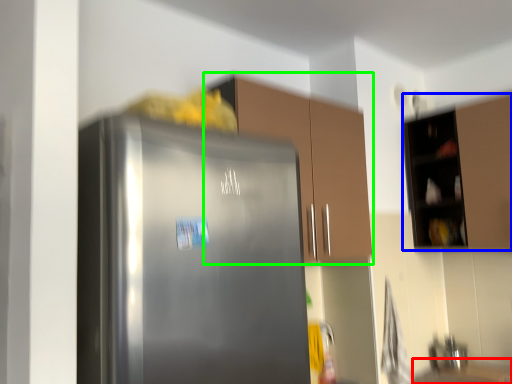
Question: Considering the real-world distances, which object is farthest from counter top (highlighted by a red box)? cabinetry (highlighted by a blue box) or cabinetry (highlighted by a green box)?

Choices:
 (A) cabinetry
 (B) cabinetry

Answer: (B)